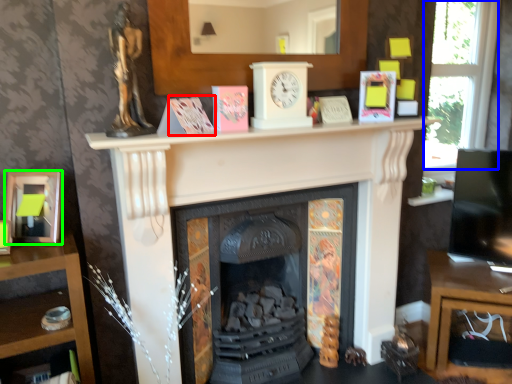
Question: Which is farther away from paperback book (highlighted by a red box)? window (highlighted by a blue box) or picture frame (highlighted by a green box)?

Choices:
 (A) window
 (B) picture frame

Answer: (A)